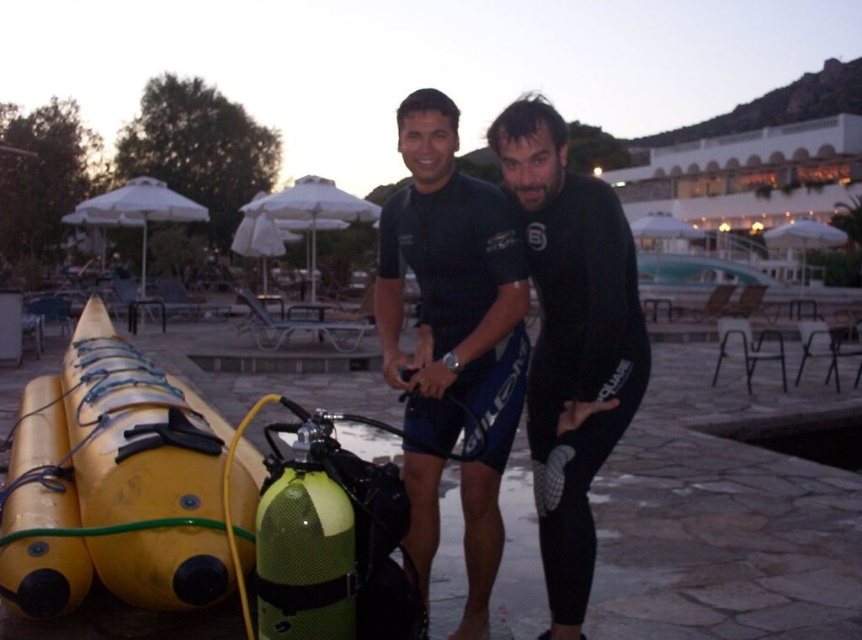
Based on the scene description, where is the black matte wetsuit at center located in terms of coordinates?

The black matte wetsuit at center is located at coordinates point (x=558, y=332).

You are a guest at the resort and want to take a photo with the yellow matte kayak at lower left and the black neoprene wetsuit at center. If you stand in front of the kayak, will the wetsuit be visible in your photo?

The yellow matte kayak at lower left is positioned under the black neoprene wetsuit at center, so if you stand in front of the kayak, the wetsuit will be visible in your photo because it is above the kayak.